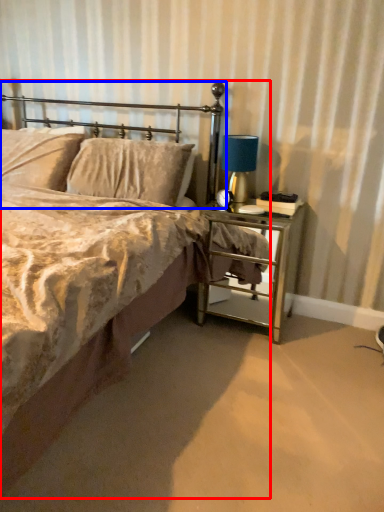
Question: Which object appears closest to the camera in this image, bed (highlighted by a red box) or headboard (highlighted by a blue box)?

Choices:
 (A) bed
 (B) headboard

Answer: (A)